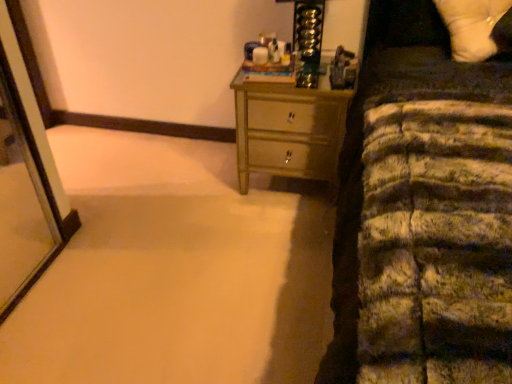
Where is `vacant space to the left of metallic gold chest of drawers at center`? This screenshot has width=512, height=384. vacant space to the left of metallic gold chest of drawers at center is located at coordinates (200, 169).